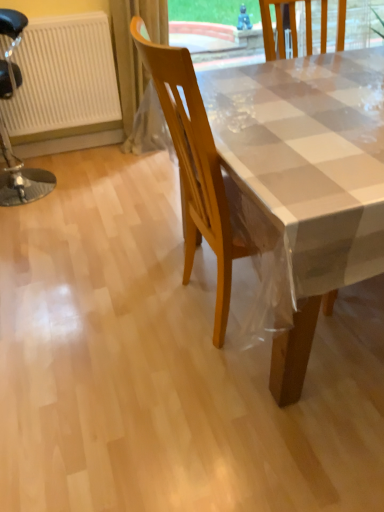
Question: Is white textured radiator at left looking in the opposite direction of black leather stool at left, positioned as the second chair in right-to-left order?

Choices:
 (A) yes
 (B) no

Answer: (A)

Question: Can you confirm if white textured radiator at left is positioned to the right of black leather stool at left, positioned as the second chair in right-to-left order?

Choices:
 (A) no
 (B) yes

Answer: (B)

Question: Is white textured radiator at left positioned before black leather stool at left, positioned as the second chair in right-to-left order?

Choices:
 (A) yes
 (B) no

Answer: (B)

Question: Is there a large distance between white textured radiator at left and black leather stool at left, which appears as the 1th chair when viewed from the back?

Choices:
 (A) no
 (B) yes

Answer: (A)

Question: Is white textured radiator at left smaller than black leather stool at left, positioned as the second chair in right-to-left order?

Choices:
 (A) yes
 (B) no

Answer: (A)

Question: In the image, is wooden chair at center, the first chair from the right, positioned in front of or behind white textured radiator at left?

Choices:
 (A) front
 (B) behind

Answer: (A)

Question: Is point (326, 8) closer or farther from the camera than point (36, 25)?

Choices:
 (A) closer
 (B) farther

Answer: (B)

Question: In terms of width, does wooden chair at center, which is counted as the second chair, starting from the back, look wider or thinner when compared to white textured radiator at left?

Choices:
 (A) wide
 (B) thin

Answer: (A)

Question: Choose the correct answer: Is wooden chair at center, the second chair from the left, inside white textured radiator at left or outside it?

Choices:
 (A) inside
 (B) outside

Answer: (B)

Question: Considering the positions of translucent plastic curtain at upper left and wooden chair at center, the second chair from the left, in the image, is translucent plastic curtain at upper left wider or thinner than wooden chair at center, the second chair from the left,?

Choices:
 (A) wide
 (B) thin

Answer: (B)

Question: Based on their positions, is translucent plastic curtain at upper left located to the left or right of wooden chair at center, the first chair positioned from the front?

Choices:
 (A) left
 (B) right

Answer: (A)

Question: In the image, is translucent plastic curtain at upper left positioned in front of or behind wooden chair at center, the second chair from the left?

Choices:
 (A) front
 (B) behind

Answer: (B)

Question: Is translucent plastic curtain at upper left bigger or smaller than wooden chair at center, the second chair from the left?

Choices:
 (A) small
 (B) big

Answer: (A)

Question: Is wooden chair at center, the first chair from the right, bigger or smaller than black leather stool at left, placed as the 2th chair when sorted from front to back?

Choices:
 (A) small
 (B) big

Answer: (B)

Question: Is wooden chair at center, the second chair from the left, wider or thinner than black leather stool at left, which appears as the 1th chair when viewed from the back?

Choices:
 (A) wide
 (B) thin

Answer: (A)